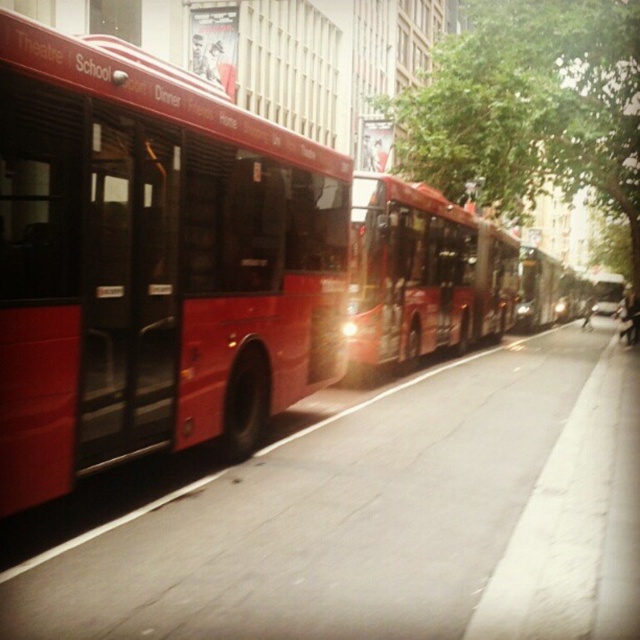
Which is behind, point (385, 266) or point (552, 310)?

Positioned behind is point (552, 310).

Which is more to the right, shiny red bus at center or metallic red bus at center?

metallic red bus at center

Image resolution: width=640 pixels, height=640 pixels. What are the coordinates of `shiny red bus at center` in the screenshot? It's located at (422, 273).

What do you see at coordinates (150, 260) in the screenshot? This screenshot has width=640, height=640. I see `matte red bus at left` at bounding box center [150, 260].

From the picture: Which is more to the right, matte red bus at left or metallic red bus at center?

metallic red bus at center is more to the right.

This screenshot has height=640, width=640. Find the location of `matte red bus at left`. matte red bus at left is located at coordinates (150, 260).

Does matte red bus at left appear on the right side of shiny red bus at center?

In fact, matte red bus at left is to the left of shiny red bus at center.

From the picture: How much distance is there between matte red bus at left and shiny red bus at center?

matte red bus at left and shiny red bus at center are 16.27 feet apart.

Where is `matte red bus at left`? This screenshot has width=640, height=640. matte red bus at left is located at coordinates (150, 260).

Find the location of a particular element. This screenshot has height=640, width=640. matte red bus at left is located at coordinates (150, 260).